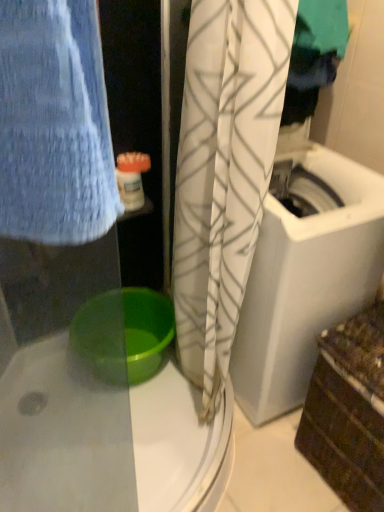
What do you see at coordinates (131, 179) in the screenshot?
I see `white plastic container at upper center` at bounding box center [131, 179].

Where is `green plastic basin at lower center`? green plastic basin at lower center is located at coordinates (123, 334).

Is white textured curtain at center positioned far away from green plastic basin at lower center?

→ No, white textured curtain at center is in close proximity to green plastic basin at lower center.

Does white textured curtain at center come behind green plastic basin at lower center?

No, it is in front of green plastic basin at lower center.

From a real-world perspective, between white textured curtain at center and green plastic basin at lower center, who is vertically higher?

From a 3D spatial view, white textured curtain at center is above.

Considering the positions of points (210, 391) and (144, 344), is point (210, 391) farther from camera compared to point (144, 344)?

That is False.

Would you say white textured curtain at center is part of white plastic container at upper center's contents?

Definitely not — white textured curtain at center is not inside white plastic container at upper center.

Is point (135, 202) farther from viewer compared to point (189, 353)?

No, it is not.

Is white plastic container at upper center bigger or smaller than white textured curtain at center?

Considering their sizes, white plastic container at upper center takes up less space than white textured curtain at center.

Does white plastic container at upper center come in front of white textured curtain at center?

No, white plastic container at upper center is further to the viewer.

In the scene shown: Is white plastic container at upper center to the left or to the right of green plastic basin at lower center in the image?

Clearly, white plastic container at upper center is on the right of green plastic basin at lower center in the image.

Is white plastic container at upper center surrounding green plastic basin at lower center?

Actually, green plastic basin at lower center is outside white plastic container at upper center.

Which is behind, point (116, 169) or point (153, 292)?

The point (153, 292) is more distant.

Does point (114, 335) come closer to viewer compared to point (178, 164)?

No.

Would you say green plastic basin at lower center is outside white textured curtain at center?

green plastic basin at lower center lies outside white textured curtain at center's area.

How different are the orientations of green plastic basin at lower center and white textured curtain at center in degrees?

The angular difference between green plastic basin at lower center and white textured curtain at center is 75.4 degrees.

How much distance is there between white textured curtain at center and white plastic container at upper center?

A distance of 40.73 centimeters exists between white textured curtain at center and white plastic container at upper center.

You are a GUI agent. You are given a task and a screenshot of the screen. Output one action in this format:
    pyautogui.click(x=<x>, y=<y>)
    Task: Click on the curtain that appears below the white plastic container at upper center (from a real-world perspective)
    
    Given the screenshot: What is the action you would take?
    pyautogui.click(x=224, y=173)

Which point is more distant from viewer, (199, 313) or (136, 161)?

The point (136, 161) is behind.

In terms of height, does white textured curtain at center look taller or shorter compared to white plastic container at upper center?

In the image, white textured curtain at center appears to be taller than white plastic container at upper center.

From a real-world perspective, between green plastic basin at lower center and white plastic container at upper center, who is vertically lower?

green plastic basin at lower center is physically lower.

Is green plastic basin at lower center outside of white plastic container at upper center?

That's correct, green plastic basin at lower center is outside of white plastic container at upper center.

Is green plastic basin at lower center oriented away from white plastic container at upper center?

No, white plastic container at upper center is not at the back of green plastic basin at lower center.

Between green plastic basin at lower center and white plastic container at upper center, which one has more height?

With more height is green plastic basin at lower center.

Locate an element on the screen. The height and width of the screenshot is (512, 384). basin on the left of white textured curtain at center is located at coordinates (123, 334).

What are the coordinates of `curtain on the right side of white plastic container at upper center` in the screenshot? It's located at (224, 173).

Estimate the real-world distances between objects in this image. Which object is closer to white plastic container at upper center, green plastic basin at lower center or white textured curtain at center?

white textured curtain at center is positioned closer to the anchor white plastic container at upper center.

Looking at the image, which one is located closer to white textured curtain at center, green plastic basin at lower center or white plastic container at upper center?

The object closer to white textured curtain at center is green plastic basin at lower center.

Estimate the real-world distances between objects in this image. Which object is further from green plastic basin at lower center, white plastic container at upper center or white textured curtain at center?

white plastic container at upper center lies further to green plastic basin at lower center than the other object.

Based on their spatial positions, is white textured curtain at center or green plastic basin at lower center closer to white plastic container at upper center?

The object closer to white plastic container at upper center is white textured curtain at center.

Looking at the image, which one is located further to white textured curtain at center, white plastic container at upper center or green plastic basin at lower center?

Among the two, white plastic container at upper center is located further to white textured curtain at center.

Based on their spatial positions, is white textured curtain at center or white plastic container at upper center further from green plastic basin at lower center?

Among the two, white plastic container at upper center is located further to green plastic basin at lower center.

Image resolution: width=384 pixels, height=512 pixels. In order to click on basin between white textured curtain at center and white plastic container at upper center from front to back in this screenshot , I will do `click(123, 334)`.